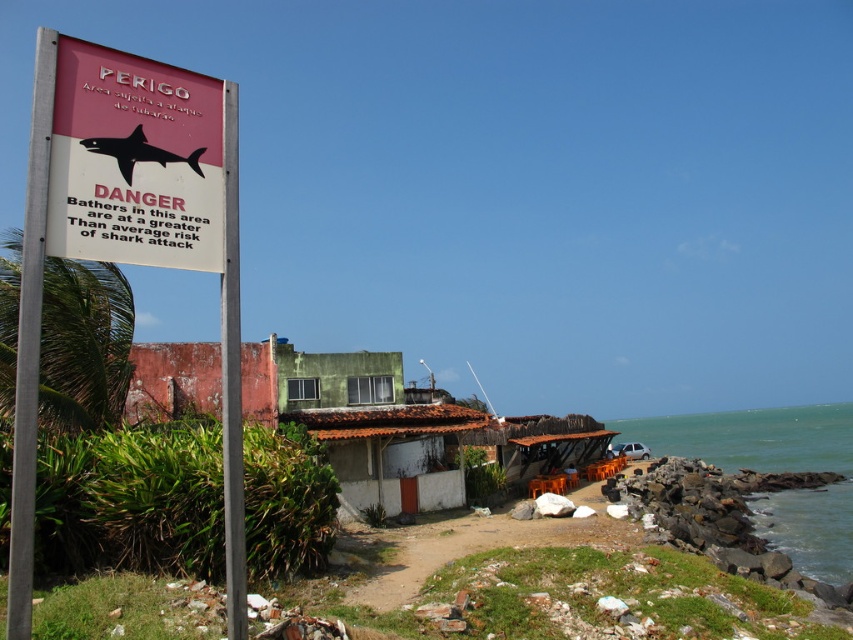
Question: Where is metallic signboard at left located in relation to silver metallic pole at left in the image?

Choices:
 (A) below
 (B) above

Answer: (A)

Question: Does silver metallic pole at left appear under metallic signpost at left?

Choices:
 (A) yes
 (B) no

Answer: (B)

Question: Among these points, which one is nearest to the camera?

Choices:
 (A) (231, 586)
 (B) (840, 570)

Answer: (A)

Question: Is matte plastic sign at upper left above green water at lower right?

Choices:
 (A) yes
 (B) no

Answer: (A)

Question: Which of the following is the farthest from the observer?

Choices:
 (A) (32, 246)
 (B) (222, 152)

Answer: (B)

Question: Which object appears farthest from the camera in this image?

Choices:
 (A) silver metallic pole at left
 (B) metallic signboard at left

Answer: (A)